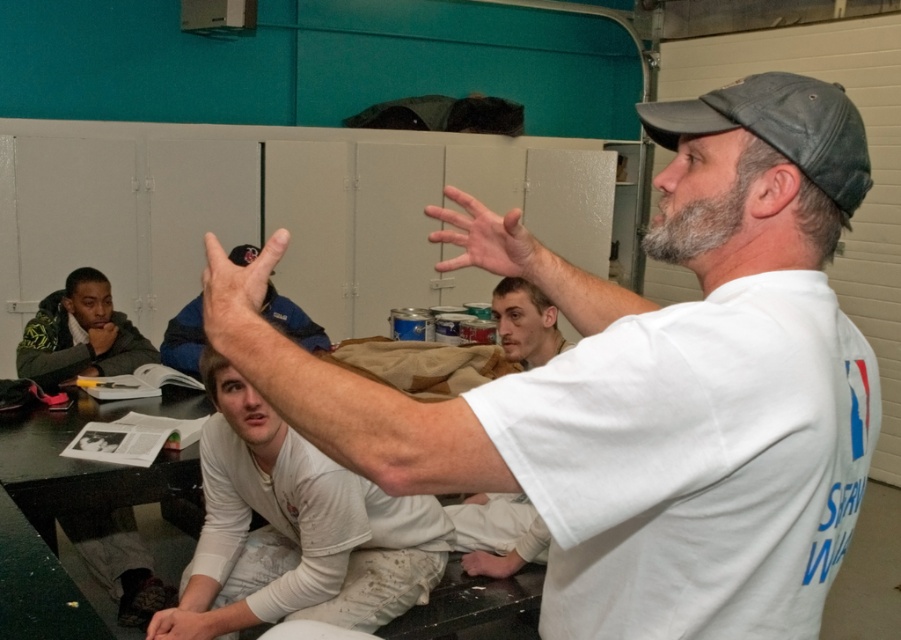
Looking at the image, where is the dark gray fabric baseball cap at upper right in relation to the matte black hand at upper left?

The dark gray fabric baseball cap at upper right is located to the right of the matte black hand at upper left.

You are standing in the room and want to locate the point at coordinates (299, 524). Based on the scene description, where would this point be located?

The point at coordinates (299, 524) is on the white matte shirt at lower center.